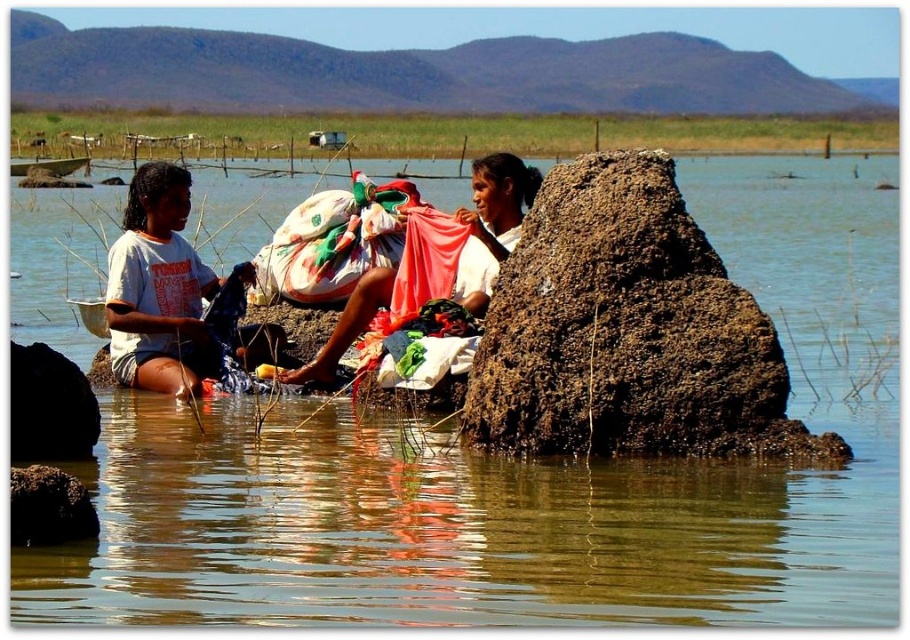
Locate an element on the screen. Image resolution: width=910 pixels, height=640 pixels. clear water at center is located at coordinates (531, 477).

Looking at this image, does clear water at center have a greater width compared to white cotton shirt at center?

Yes, clear water at center is wider than white cotton shirt at center.

Which is behind, point (279, 596) or point (491, 188)?

The point (491, 188) is behind.

Find the location of `clear water at center`. clear water at center is located at coordinates (531, 477).

At what (x,y) coordinates should I click in order to perform the action: click on brown mud rock at right. Please return your answer as a coordinate pair (x, y). The height and width of the screenshot is (640, 910). Looking at the image, I should click on (627, 332).

Who is positioned more to the right, brown mud rock at right or white cotton shirt at left?

brown mud rock at right

Measure the distance between brown mud rock at right and camera.

33.87 meters

I want to click on brown mud rock at right, so click(x=627, y=332).

Measure the distance between clear water at center and white cotton shirt at left.

clear water at center is 48.45 meters from white cotton shirt at left.

Is clear water at center to the left of white cotton shirt at left from the viewer's perspective?

Incorrect, clear water at center is not on the left side of white cotton shirt at left.

Where is `clear water at center`? This screenshot has width=910, height=640. clear water at center is located at coordinates (531, 477).